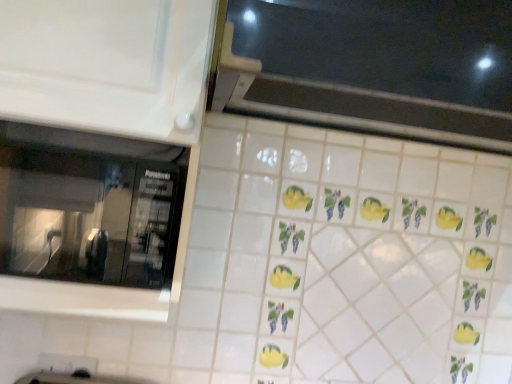
Question: From the image's perspective, is black glass window at upper center, the 2th window from the left, located above or below transparent glass microwave at left, the first window positioned from the bottom?

Choices:
 (A) above
 (B) below

Answer: (A)

Question: Is black glass window at upper center, which ranks as the 1th window in top-to-bottom order, to the left or to the right of transparent glass microwave at left, the 1th window when ordered from left to right, in the image?

Choices:
 (A) left
 (B) right

Answer: (B)

Question: Do you think black glass window at upper center, marked as the 1th window in a right-to-left arrangement, is within transparent glass microwave at left, the second window viewed from the top, or outside of it?

Choices:
 (A) inside
 (B) outside

Answer: (B)

Question: Relative to black glass window at upper center, the 2th window from the left, is transparent glass microwave at left, the 1th window when ordered from left to right, in front or behind?

Choices:
 (A) front
 (B) behind

Answer: (B)

Question: Is transparent glass microwave at left, the first window positioned from the bottom, wider or thinner than black glass window at upper center, which ranks as the 1th window in top-to-bottom order?

Choices:
 (A) thin
 (B) wide

Answer: (A)

Question: Considering the relative positions of transparent glass microwave at left, the second window viewed from the top, and black glass window at upper center, the 2th window from the left, in the image provided, is transparent glass microwave at left, the second window viewed from the top, to the left or to the right of black glass window at upper center, the 2th window from the left,?

Choices:
 (A) right
 (B) left

Answer: (B)

Question: Is transparent glass microwave at left, the 1th window when ordered from left to right, taller or shorter than black glass window at upper center, which ranks as the 1th window in top-to-bottom order?

Choices:
 (A) tall
 (B) short

Answer: (B)